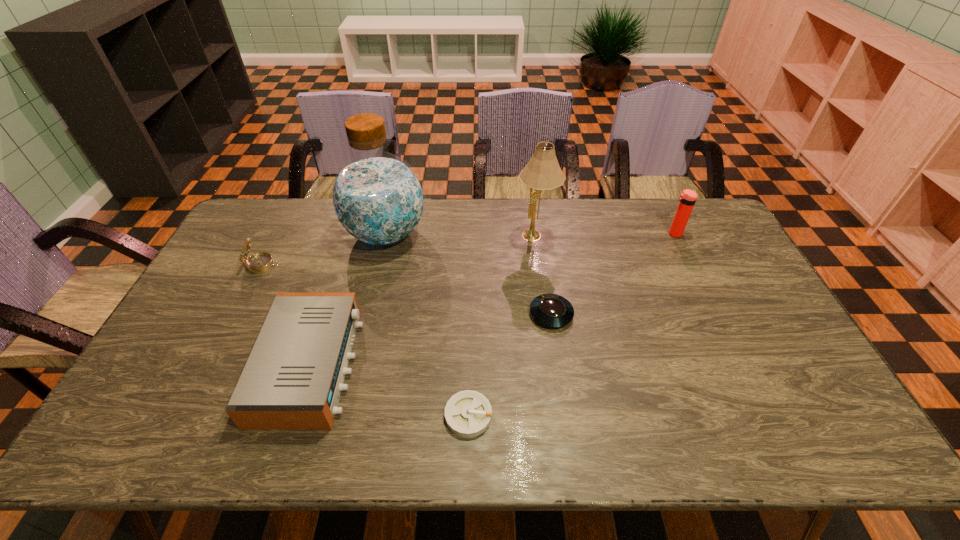
At what (x,y) coordinates should I click in order to perform the action: click on water jug. Please return your answer as a coordinate pair (x, y). The width and height of the screenshot is (960, 540). Looking at the image, I should click on (378, 199).

You are a GUI agent. You are given a task and a screenshot of the screen. Output one action in this format:
    pyautogui.click(x=<x>, y=<y>)
    Task: Click on the lampshade
    Image resolution: width=960 pixels, height=540 pixels.
    Given the screenshot: What is the action you would take?
    pyautogui.click(x=542, y=172)

Locate an element on the screen. thermos bottle is located at coordinates (687, 199).

This screenshot has height=540, width=960. Identify the location of the rightmost object. (687, 199).

Locate an element on the screen. The height and width of the screenshot is (540, 960). the leftmost object is located at coordinates (260, 262).

This screenshot has height=540, width=960. In order to click on compass in this screenshot , I will do `click(260, 262)`.

The height and width of the screenshot is (540, 960). I want to click on radio receiver, so click(293, 378).

The image size is (960, 540). Find the location of `the second shortest object`. the second shortest object is located at coordinates (551, 310).

Where is `the shortest object`? The height and width of the screenshot is (540, 960). the shortest object is located at coordinates (468, 413).

Identify the location of the fourth object from right to left. The height and width of the screenshot is (540, 960). (468, 413).